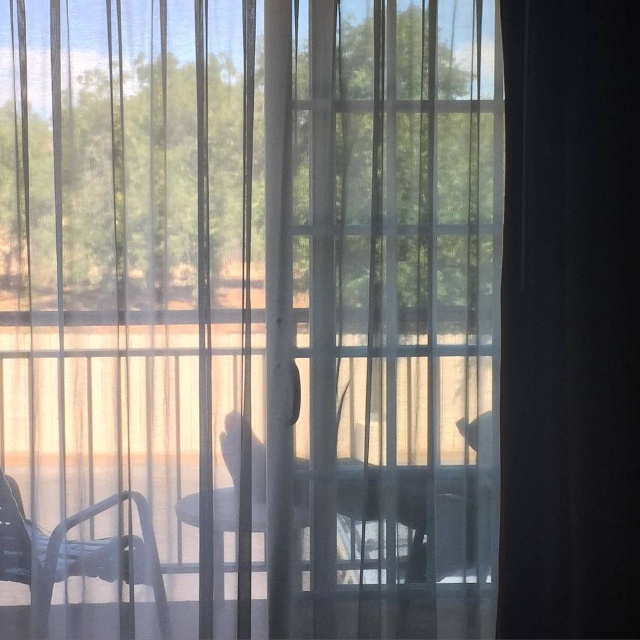
Who is taller, transparent fabric screen door at center or black fabric curtain at right?

transparent fabric screen door at center is taller.

Between point (486, 524) and point (548, 70), which one is positioned in front?

Positioned in front is point (548, 70).

Identify the location of transparent fabric screen door at center. This screenshot has height=640, width=640. (397, 300).

Is transparent fabric screen door at center to the left of metallic silver chair at lower left from the viewer's perspective?

No, transparent fabric screen door at center is not to the left of metallic silver chair at lower left.

Between point (349, 308) and point (45, 554), which one is positioned in front?

Point (45, 554) is more forward.

The image size is (640, 640). Identify the location of transparent fabric screen door at center. (397, 300).

Is black fabric curtain at right smaller than clear glass table at center?

No, black fabric curtain at right is not smaller than clear glass table at center.

Find the location of a particular element. This screenshot has width=640, height=640. black fabric curtain at right is located at coordinates (570, 321).